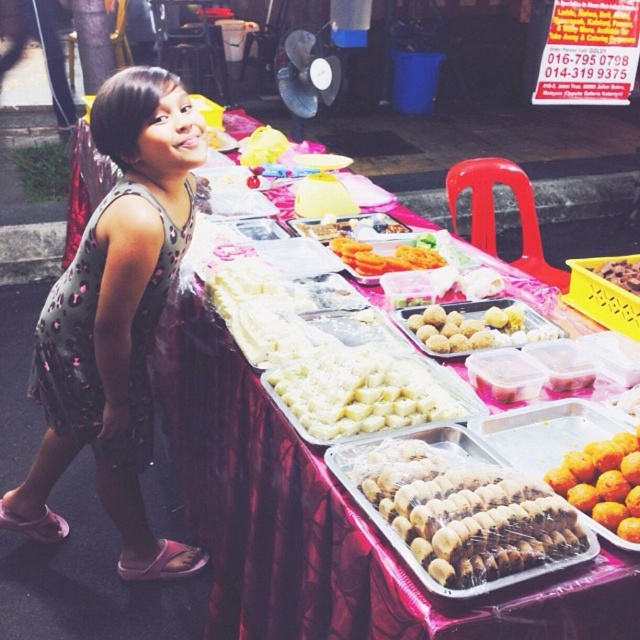
You are a customer at the food stall and want to point out both the printed fabric dress at left and the brown matte cookies at center to the vendor. Which one is located lower in the image?

The printed fabric dress at left is located lower in the image because it is below the brown matte cookies at center.

You are a food critic standing at the edge of the table and want to taste the golden brown doughnut at center. Based on its position, can you estimate where exactly it is placed on the table?

The golden brown doughnut at center is located at point (476, 326), which is near the middle of the table.